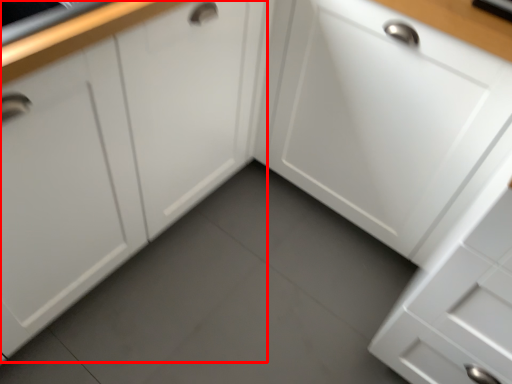
Question: In this image, where is cabinetry (annotated by the red box) located relative to cabinetry?

Choices:
 (A) left
 (B) right

Answer: (A)